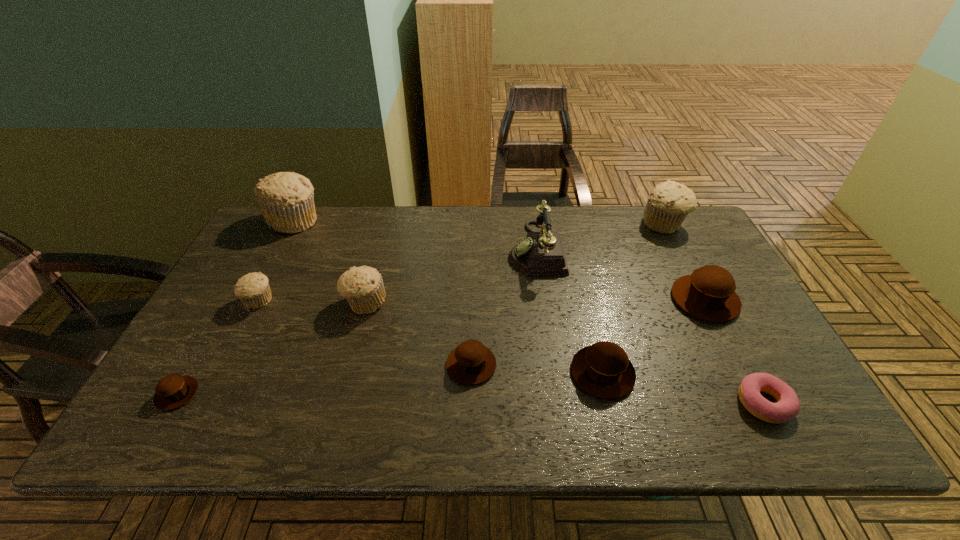
At what (x,y) coordinates should I click in order to perform the action: click on vacant space that satisfies the following two spatial constraints: 1. on the front side of the smallest beige muffin; 2. on the left side of the third biggest beige muffin. Please return your answer as a coordinate pair (x, y). Image resolution: width=960 pixels, height=540 pixels. Looking at the image, I should click on (258, 303).

The image size is (960, 540). Find the location of `free space that satisfies the following two spatial constraints: 1. on the back side of the smallest brown muffin; 2. on the right side of the third brown muffin from left to right`. free space that satisfies the following two spatial constraints: 1. on the back side of the smallest brown muffin; 2. on the right side of the third brown muffin from left to right is located at coordinates (189, 373).

In order to click on vacant space that satisfies the following two spatial constraints: 1. on the back side of the doughnut; 2. on the dial of the telephone in this screenshot , I will do `click(683, 249)`.

Identify the location of vacant space that satisfies the following two spatial constraints: 1. on the dial of the telephone; 2. on the front side of the smallest beige muffin. The width and height of the screenshot is (960, 540). (543, 301).